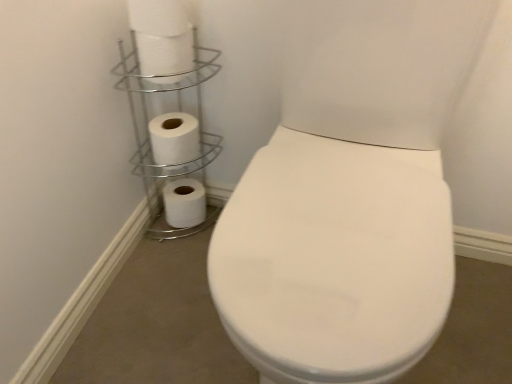
Locate an element on the screen. The width and height of the screenshot is (512, 384). silver/metallic toilet paper holder at upper left is located at coordinates (150, 135).

How much space does white matte toilet paper at lower left, which is the fourth toilet paper in top-to-bottom order, occupy horizontally?

white matte toilet paper at lower left, which is the fourth toilet paper in top-to-bottom order, is 4.56 inches in width.

Where is `white matte toilet paper at upper left, placed as the third toilet paper when sorted from front to back`? The image size is (512, 384). white matte toilet paper at upper left, placed as the third toilet paper when sorted from front to back is located at coordinates (174, 139).

Identify the location of white matte toilet paper at upper left, which ranks as the first toilet paper in front-to-back order. (159, 17).

From a real-world perspective, is white matte toilet paper at upper left, the 2th toilet paper in the back-to-front sequence, positioned above or below white matte toilet paper at lower left, which is the 1th toilet paper in bottom-to-top order?

white matte toilet paper at upper left, the 2th toilet paper in the back-to-front sequence, is situated higher than white matte toilet paper at lower left, which is the 1th toilet paper in bottom-to-top order, in the real world.

Is white matte toilet paper at upper left, the 2th toilet paper from the bottom, oriented away from white matte toilet paper at lower left, placed as the first toilet paper when sorted from back to front?

No, white matte toilet paper at upper left, the 2th toilet paper from the bottom, is not facing away from white matte toilet paper at lower left, placed as the first toilet paper when sorted from back to front.

This screenshot has height=384, width=512. I want to click on toilet paper on the left of white matte toilet paper at upper left, the 2th toilet paper from the bottom, so click(184, 203).

Considering the positions of objects white matte toilet paper at upper left, placed as the third toilet paper when sorted from front to back, and white matte toilet paper at lower left, which is the fourth toilet paper in top-to-bottom order, in the image provided, who is more to the left, white matte toilet paper at upper left, placed as the third toilet paper when sorted from front to back, or white matte toilet paper at lower left, which is the fourth toilet paper in top-to-bottom order,?

white matte toilet paper at lower left, which is the fourth toilet paper in top-to-bottom order, is more to the left.

Consider the image. Which is more to the right, white matte toilet paper at upper left, the 2th toilet paper from the front, or silver/metallic toilet paper holder at upper left?

white matte toilet paper at upper left, the 2th toilet paper from the front.

From a real-world perspective, who is located lower, white matte toilet paper at upper left, the 2th toilet paper from the front, or silver/metallic toilet paper holder at upper left?

From a 3D spatial view, silver/metallic toilet paper holder at upper left is below.

Is white matte toilet paper at upper left, marked as the 3th toilet paper in a bottom-to-top arrangement, in front of silver/metallic toilet paper holder at upper left?

Yes, white matte toilet paper at upper left, marked as the 3th toilet paper in a bottom-to-top arrangement, is in front of silver/metallic toilet paper holder at upper left.

How many degrees apart are the facing directions of white matte toilet paper at upper left, the 2th toilet paper from the front, and silver/metallic toilet paper holder at upper left?

0.00342 degrees.

Is white matte toilet paper at upper left, marked as the 3th toilet paper in a bottom-to-top arrangement, in front of or behind white matte toilet paper at lower left, which is the 1th toilet paper in bottom-to-top order, in the image?

Clearly, white matte toilet paper at upper left, marked as the 3th toilet paper in a bottom-to-top arrangement, is in front of white matte toilet paper at lower left, which is the 1th toilet paper in bottom-to-top order.

Is point (170, 75) farther from camera compared to point (172, 184)?

That is False.

Between white matte toilet paper at upper left, marked as the 3th toilet paper in a bottom-to-top arrangement, and white matte toilet paper at lower left, placed as the first toilet paper when sorted from back to front, which one has larger size?

white matte toilet paper at lower left, placed as the first toilet paper when sorted from back to front.

Can you confirm if white matte toilet paper at upper left, the 2th toilet paper from the front, is taller than white matte toilet paper at lower left, placed as the first toilet paper when sorted from back to front?

No.

Based on the photo, from the image's perspective, does white matte toilet paper at lower left, placed as the first toilet paper when sorted from back to front, appear higher than white matte toilet paper at upper left, which ranks as the first toilet paper in front-to-back order?

Incorrect, from the image's perspective, white matte toilet paper at lower left, placed as the first toilet paper when sorted from back to front, is lower than white matte toilet paper at upper left, which ranks as the first toilet paper in front-to-back order.

At what (x,y) coordinates should I click in order to perform the action: click on toilet paper that is the 3rd one when counting upward from the white matte toilet paper at lower left, which is the 1th toilet paper in bottom-to-top order (from the image's perspective). Please return your answer as a coordinate pair (x, y). The width and height of the screenshot is (512, 384). Looking at the image, I should click on 159,17.

From the picture: Is the position of white matte toilet paper at lower left, placed as the first toilet paper when sorted from back to front, less distant than that of white matte toilet paper at upper left, which is counted as the 4th toilet paper, starting from the back?

That is False.

Based on the photo, does white matte toilet paper at lower left, which is the fourth toilet paper in top-to-bottom order, lie behind silver/metallic toilet paper holder at upper left?

Yes, the depth of white matte toilet paper at lower left, which is the fourth toilet paper in top-to-bottom order, is greater than that of silver/metallic toilet paper holder at upper left.

Who is taller, white matte toilet paper at lower left, which is the 1th toilet paper in bottom-to-top order, or silver/metallic toilet paper holder at upper left?

silver/metallic toilet paper holder at upper left.

Which is in front, point (130, 15) or point (149, 132)?

Point (130, 15)

How different are the orientations of white matte toilet paper at upper left, which ranks as the first toilet paper in front-to-back order, and white matte toilet paper at upper left, the 2th toilet paper in the back-to-front sequence, in degrees?

The angle between the facing direction of white matte toilet paper at upper left, which ranks as the first toilet paper in front-to-back order, and the facing direction of white matte toilet paper at upper left, the 2th toilet paper in the back-to-front sequence, is 0.00346 degrees.

Is white matte toilet paper at upper left, which is counted as the 4th toilet paper, starting from the back, next to white matte toilet paper at upper left, the 2th toilet paper in the back-to-front sequence?

No, white matte toilet paper at upper left, which is counted as the 4th toilet paper, starting from the back, is not with white matte toilet paper at upper left, the 2th toilet paper in the back-to-front sequence.

Would you say white matte toilet paper at upper left, the 3th toilet paper in the top-to-bottom sequence, is part of white matte toilet paper at upper left, positioned as the 1th toilet paper in top-to-bottom order,'s contents?

No, white matte toilet paper at upper left, the 3th toilet paper in the top-to-bottom sequence, is not inside white matte toilet paper at upper left, positioned as the 1th toilet paper in top-to-bottom order.

From the image's perspective, does white matte toilet paper at upper left, the 2th toilet paper from the bottom, appear lower than silver/metallic toilet paper holder at upper left?

No, from the image's perspective, white matte toilet paper at upper left, the 2th toilet paper from the bottom, is not below silver/metallic toilet paper holder at upper left.

How distant is white matte toilet paper at upper left, the 2th toilet paper from the bottom, from silver/metallic toilet paper holder at upper left?

white matte toilet paper at upper left, the 2th toilet paper from the bottom, and silver/metallic toilet paper holder at upper left are 8.42 centimeters apart.

Could you tell me if white matte toilet paper at upper left, the 3th toilet paper in the top-to-bottom sequence, is turned towards silver/metallic toilet paper holder at upper left?

Yes, white matte toilet paper at upper left, the 3th toilet paper in the top-to-bottom sequence, is oriented towards silver/metallic toilet paper holder at upper left.

Would you say white matte toilet paper at upper left, the 2th toilet paper in the back-to-front sequence, is to the left or to the right of silver/metallic toilet paper holder at upper left in the picture?

white matte toilet paper at upper left, the 2th toilet paper in the back-to-front sequence, is to the left of silver/metallic toilet paper holder at upper left.

Where is `toilet paper behind the white matte toilet paper at upper left, the 2th toilet paper from the bottom`? toilet paper behind the white matte toilet paper at upper left, the 2th toilet paper from the bottom is located at coordinates (184, 203).

In the image, there is a white matte toilet paper at upper left, marked as the 3th toilet paper in a bottom-to-top arrangement. At what (x,y) coordinates should I click in order to perform the action: click on shelf below it (from the image's perspective). Please return your answer as a coordinate pair (x, y). The height and width of the screenshot is (384, 512). Looking at the image, I should click on (150, 135).

Based on their spatial positions, is white matte toilet paper at lower left, which ranks as the fourth toilet paper in front-to-back order, or white matte toilet paper at upper left, the 2th toilet paper from the bottom, closer to silver/metallic toilet paper holder at upper left?

white matte toilet paper at upper left, the 2th toilet paper from the bottom, is positioned closer to the anchor silver/metallic toilet paper holder at upper left.

When comparing their distances from white matte toilet paper at lower left, which ranks as the fourth toilet paper in front-to-back order, does silver/metallic toilet paper holder at upper left or white matte toilet paper at upper left, positioned as the 1th toilet paper in top-to-bottom order, seem further?

white matte toilet paper at upper left, positioned as the 1th toilet paper in top-to-bottom order, is positioned further to the anchor white matte toilet paper at lower left, which ranks as the fourth toilet paper in front-to-back order.

Estimate the real-world distances between objects in this image. Which object is closer to white matte toilet paper at upper left, which ranks as the first toilet paper in front-to-back order, white matte toilet paper at upper left, marked as the 3th toilet paper in a bottom-to-top arrangement, or white matte toilet paper at upper left, the 3th toilet paper in the top-to-bottom sequence?

white matte toilet paper at upper left, marked as the 3th toilet paper in a bottom-to-top arrangement.

Estimate the real-world distances between objects in this image. Which object is closer to white matte toilet paper at upper left, which ranks as the first toilet paper in front-to-back order, white matte toilet paper at upper left, marked as the 3th toilet paper in a bottom-to-top arrangement, or silver/metallic toilet paper holder at upper left?

white matte toilet paper at upper left, marked as the 3th toilet paper in a bottom-to-top arrangement, is positioned closer to the anchor white matte toilet paper at upper left, which ranks as the first toilet paper in front-to-back order.

Based on their spatial positions, is silver/metallic toilet paper holder at upper left or white matte toilet paper at upper left, the fourth toilet paper in the bottom-to-top sequence, closer to white matte toilet paper at upper left, placed as the second toilet paper when sorted from top to bottom?

white matte toilet paper at upper left, the fourth toilet paper in the bottom-to-top sequence, is positioned closer to the anchor white matte toilet paper at upper left, placed as the second toilet paper when sorted from top to bottom.

From the image, which object appears to be nearer to white matte toilet paper at upper left, which is counted as the third toilet paper, starting from the back, silver/metallic toilet paper holder at upper left or white matte toilet paper at upper left, the 3th toilet paper in the top-to-bottom sequence?

white matte toilet paper at upper left, the 3th toilet paper in the top-to-bottom sequence, is positioned closer to the anchor white matte toilet paper at upper left, which is counted as the third toilet paper, starting from the back.

Considering their positions, is white matte toilet paper at upper left, placed as the second toilet paper when sorted from top to bottom, positioned closer to white matte toilet paper at upper left, the 2th toilet paper from the bottom, than white matte toilet paper at upper left, positioned as the 1th toilet paper in top-to-bottom order?

white matte toilet paper at upper left, placed as the second toilet paper when sorted from top to bottom, lies closer to white matte toilet paper at upper left, the 2th toilet paper from the bottom, than the other object.

From the image, which object appears to be farther from white matte toilet paper at upper left, the 2th toilet paper from the bottom, white matte toilet paper at lower left, placed as the first toilet paper when sorted from back to front, or white matte toilet paper at upper left, marked as the 3th toilet paper in a bottom-to-top arrangement?

white matte toilet paper at upper left, marked as the 3th toilet paper in a bottom-to-top arrangement, is positioned further to the anchor white matte toilet paper at upper left, the 2th toilet paper from the bottom.

I want to click on toilet paper that lies between white matte toilet paper at upper left, which ranks as the first toilet paper in front-to-back order, and white matte toilet paper at upper left, the 3th toilet paper in the top-to-bottom sequence, from top to bottom, so click(165, 56).

At what (x,y) coordinates should I click in order to perform the action: click on toilet paper between white matte toilet paper at upper left, marked as the 3th toilet paper in a bottom-to-top arrangement, and silver/metallic toilet paper holder at upper left, in the vertical direction. Please return your answer as a coordinate pair (x, y). Looking at the image, I should click on (174, 139).

The width and height of the screenshot is (512, 384). What are the coordinates of `shelf between white matte toilet paper at upper left, the 2th toilet paper from the front, and white matte toilet paper at lower left, which is the 1th toilet paper in bottom-to-top order, along the z-axis` in the screenshot? It's located at (150, 135).

Where is `shelf between white matte toilet paper at upper left, which is counted as the 4th toilet paper, starting from the back, and white matte toilet paper at lower left, which ranks as the fourth toilet paper in front-to-back order, in the up-down direction`? This screenshot has height=384, width=512. shelf between white matte toilet paper at upper left, which is counted as the 4th toilet paper, starting from the back, and white matte toilet paper at lower left, which ranks as the fourth toilet paper in front-to-back order, in the up-down direction is located at coordinates (150, 135).